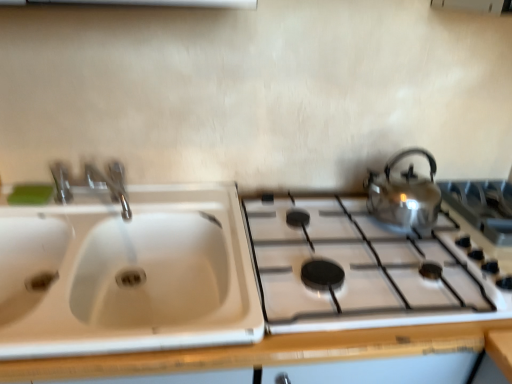
What do you see at coordinates (360, 268) in the screenshot? This screenshot has width=512, height=384. I see `shiny metallic gas stove at right, arranged as the second gas stove when viewed from the right` at bounding box center [360, 268].

The image size is (512, 384). I want to click on shiny metallic kettle at right, so click(x=405, y=195).

Find the location of a particular element. This screenshot has height=384, width=512. satin silver gas stove at right, which is the first gas stove from right to left is located at coordinates [483, 206].

Measure the distance between point [495,228] and camera.

They are 3.84 feet apart.

Where is `white plastic sink at left`? white plastic sink at left is located at coordinates (125, 269).

Is satin silver gas stove at right, the 2th gas stove from the left, oriented towards green matte soap at upper left?

Yes, satin silver gas stove at right, the 2th gas stove from the left, faces towards green matte soap at upper left.

Is satin silver gas stove at right, the 2th gas stove from the left, positioned far away from green matte soap at upper left?

Yes, satin silver gas stove at right, the 2th gas stove from the left, is far from green matte soap at upper left.

This screenshot has height=384, width=512. In order to click on gas stove that is the 2nd object to the right of the green matte soap at upper left, starting at the anchor in this screenshot , I will do `click(483, 206)`.

Is shiny metallic gas stove at right, arranged as the second gas stove when viewed from the right, to the left or to the right of green matte soap at upper left in the image?

Clearly, shiny metallic gas stove at right, arranged as the second gas stove when viewed from the right, is on the right of green matte soap at upper left in the image.

Is shiny metallic gas stove at right, the 1th gas stove viewed from the left, turned away from green matte soap at upper left?

shiny metallic gas stove at right, the 1th gas stove viewed from the left, is not turned away from green matte soap at upper left.

Can you tell me how much shiny metallic gas stove at right, arranged as the second gas stove when viewed from the right, and green matte soap at upper left differ in facing direction?

The angle between the facing direction of shiny metallic gas stove at right, arranged as the second gas stove when viewed from the right, and the facing direction of green matte soap at upper left is 1.22 degrees.

Is shiny metallic gas stove at right, arranged as the second gas stove when viewed from the right, far from green matte soap at upper left?

No, shiny metallic gas stove at right, arranged as the second gas stove when viewed from the right, is in close proximity to green matte soap at upper left.

How far apart are shiny metallic gas stove at right, the 1th gas stove viewed from the left, and satin silver gas stove at right, the 2th gas stove from the left?

A distance of 13.71 inches exists between shiny metallic gas stove at right, the 1th gas stove viewed from the left, and satin silver gas stove at right, the 2th gas stove from the left.

Between shiny metallic gas stove at right, the 1th gas stove viewed from the left, and satin silver gas stove at right, which is the first gas stove from right to left, which one has smaller width?

Thinner between the two is satin silver gas stove at right, which is the first gas stove from right to left.

Considering the positions of objects shiny metallic gas stove at right, the 1th gas stove viewed from the left, and satin silver gas stove at right, the 2th gas stove from the left, in the image provided, who is more to the left, shiny metallic gas stove at right, the 1th gas stove viewed from the left, or satin silver gas stove at right, the 2th gas stove from the left,?

From the viewer's perspective, shiny metallic gas stove at right, the 1th gas stove viewed from the left, appears more on the left side.

I want to click on gas stove directly beneath the satin silver gas stove at right, the 2th gas stove from the left (from a real-world perspective), so click(x=360, y=268).

Is point (503, 213) positioned behind point (417, 150)?

Yes, point (503, 213) is farther from viewer.

Considering the relative sizes of satin silver gas stove at right, the 2th gas stove from the left, and shiny metallic kettle at right in the image provided, is satin silver gas stove at right, the 2th gas stove from the left, bigger than shiny metallic kettle at right?

No, satin silver gas stove at right, the 2th gas stove from the left, is not bigger than shiny metallic kettle at right.

From a real-world perspective, does satin silver gas stove at right, which is the first gas stove from right to left, stand above shiny metallic kettle at right?

No, from a real-world perspective, satin silver gas stove at right, which is the first gas stove from right to left, is not on top of shiny metallic kettle at right.

Would you say shiny metallic kettle at right is part of satin silver gas stove at right, the 2th gas stove from the left,'s contents?

Definitely not — shiny metallic kettle at right is not inside satin silver gas stove at right, the 2th gas stove from the left.

From the image's perspective, which one is positioned higher, satin silver gas stove at right, which is the first gas stove from right to left, or shiny metallic gas stove at right, the 1th gas stove viewed from the left?

satin silver gas stove at right, which is the first gas stove from right to left, appears higher in the image.

Can you confirm if satin silver gas stove at right, which is the first gas stove from right to left, is taller than shiny metallic gas stove at right, the 1th gas stove viewed from the left?

Yes.

Between point (510, 186) and point (302, 239), which one is positioned in front?

The point (302, 239) is in front.

The width and height of the screenshot is (512, 384). Find the location of `gas stove that is in front of the satin silver gas stove at right, which is the first gas stove from right to left`. gas stove that is in front of the satin silver gas stove at right, which is the first gas stove from right to left is located at coordinates (360, 268).

From their relative heights in the image, would you say white plastic sink at left is taller or shorter than satin silver gas stove at right, which is the first gas stove from right to left?

Clearly, white plastic sink at left is taller compared to satin silver gas stove at right, which is the first gas stove from right to left.

Could you tell me if white plastic sink at left is turned towards satin silver gas stove at right, which is the first gas stove from right to left?

No, white plastic sink at left is not turned towards satin silver gas stove at right, which is the first gas stove from right to left.

Is white plastic sink at left directly adjacent to satin silver gas stove at right, the 2th gas stove from the left?

No, white plastic sink at left is not with satin silver gas stove at right, the 2th gas stove from the left.

From a real-world perspective, which is physically below, white plastic sink at left or green matte soap at upper left?

white plastic sink at left, from a real-world perspective.

Can you tell me how much white plastic sink at left and green matte soap at upper left differ in facing direction?

The facing directions of white plastic sink at left and green matte soap at upper left are 1.22 degrees apart.

Where is `soap that appears on the left of white plastic sink at left`? This screenshot has width=512, height=384. soap that appears on the left of white plastic sink at left is located at coordinates (30, 194).

Is white plastic sink at left in front of green matte soap at upper left?

Yes, it is in front of green matte soap at upper left.

Where is `gas stove that is the 2nd one when counting rightward from the green matte soap at upper left`? The image size is (512, 384). gas stove that is the 2nd one when counting rightward from the green matte soap at upper left is located at coordinates (483, 206).

At what (x,y) coordinates should I click in order to perform the action: click on gas stove that is the 2nd one when counting downward from the green matte soap at upper left (from the image's perspective). Please return your answer as a coordinate pair (x, y). The width and height of the screenshot is (512, 384). Looking at the image, I should click on (360, 268).

From the image, which object appears to be nearer to shiny metallic gas stove at right, arranged as the second gas stove when viewed from the right, shiny metallic kettle at right or green matte soap at upper left?

Based on the image, shiny metallic kettle at right appears to be nearer to shiny metallic gas stove at right, arranged as the second gas stove when viewed from the right.

Estimate the real-world distances between objects in this image. Which object is further from shiny metallic kettle at right, green matte soap at upper left or shiny metallic gas stove at right, arranged as the second gas stove when viewed from the right?

The object further to shiny metallic kettle at right is green matte soap at upper left.

From the image, which object appears to be nearer to white plastic sink at left, green matte soap at upper left or satin silver gas stove at right, the 2th gas stove from the left?

green matte soap at upper left.

Which object lies further to the anchor point shiny metallic kettle at right, satin silver gas stove at right, which is the first gas stove from right to left, or white plastic sink at left?

white plastic sink at left.

Based on their spatial positions, is white plastic sink at left or satin silver gas stove at right, the 2th gas stove from the left, further from shiny metallic gas stove at right, the 1th gas stove viewed from the left?

Based on the image, satin silver gas stove at right, the 2th gas stove from the left, appears to be further to shiny metallic gas stove at right, the 1th gas stove viewed from the left.

Considering their positions, is green matte soap at upper left positioned closer to shiny metallic gas stove at right, the 1th gas stove viewed from the left, than shiny metallic kettle at right?

The object closer to shiny metallic gas stove at right, the 1th gas stove viewed from the left, is shiny metallic kettle at right.

Based on the photo, considering their positions, is white plastic sink at left positioned closer to shiny metallic gas stove at right, the 1th gas stove viewed from the left, than green matte soap at upper left?

Based on the image, white plastic sink at left appears to be nearer to shiny metallic gas stove at right, the 1th gas stove viewed from the left.

Estimate the real-world distances between objects in this image. Which object is closer to green matte soap at upper left, satin silver gas stove at right, the 2th gas stove from the left, or shiny metallic gas stove at right, the 1th gas stove viewed from the left?

shiny metallic gas stove at right, the 1th gas stove viewed from the left.

This screenshot has width=512, height=384. Find the location of `kettle between shiny metallic gas stove at right, the 1th gas stove viewed from the left, and satin silver gas stove at right, which is the first gas stove from right to left, in the horizontal direction`. kettle between shiny metallic gas stove at right, the 1th gas stove viewed from the left, and satin silver gas stove at right, which is the first gas stove from right to left, in the horizontal direction is located at coordinates click(405, 195).

Locate an element on the screen. sink between green matte soap at upper left and shiny metallic kettle at right is located at coordinates (125, 269).

Where is `sink between green matte soap at upper left and shiny metallic gas stove at right, the 1th gas stove viewed from the left, from left to right`? The width and height of the screenshot is (512, 384). sink between green matte soap at upper left and shiny metallic gas stove at right, the 1th gas stove viewed from the left, from left to right is located at coordinates (125, 269).

This screenshot has height=384, width=512. I want to click on gas stove situated between white plastic sink at left and shiny metallic kettle at right from left to right, so click(360, 268).